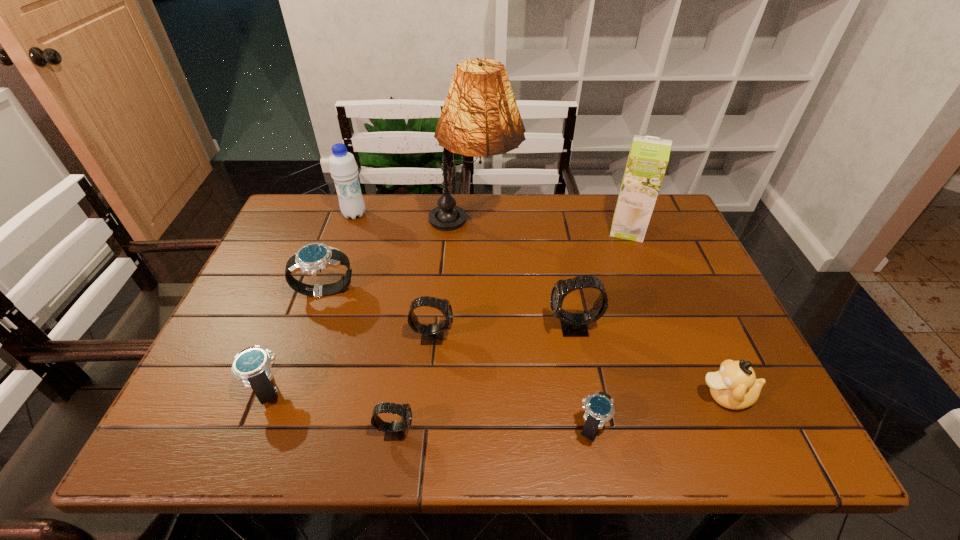
The height and width of the screenshot is (540, 960). I want to click on vacant space that satisfies the following two spatial constraints: 1. on the front-facing side of the second tallest object; 2. on the right side of the tallest object, so click(473, 230).

Locate an element on the screen. vacant region that satisfies the following two spatial constraints: 1. on the face of the duckling; 2. on the front side of the rightmost silver watch is located at coordinates (738, 426).